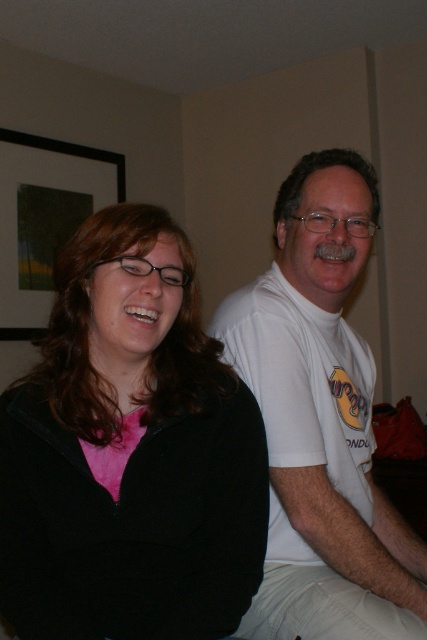
Can you confirm if black matte jacket at left is positioned to the left of white cotton t-shirt at right?

Indeed, black matte jacket at left is positioned on the left side of white cotton t-shirt at right.

Is black matte jacket at left above white cotton t-shirt at right?

No.

Identify the location of black matte jacket at left. Image resolution: width=427 pixels, height=640 pixels. (129, 454).